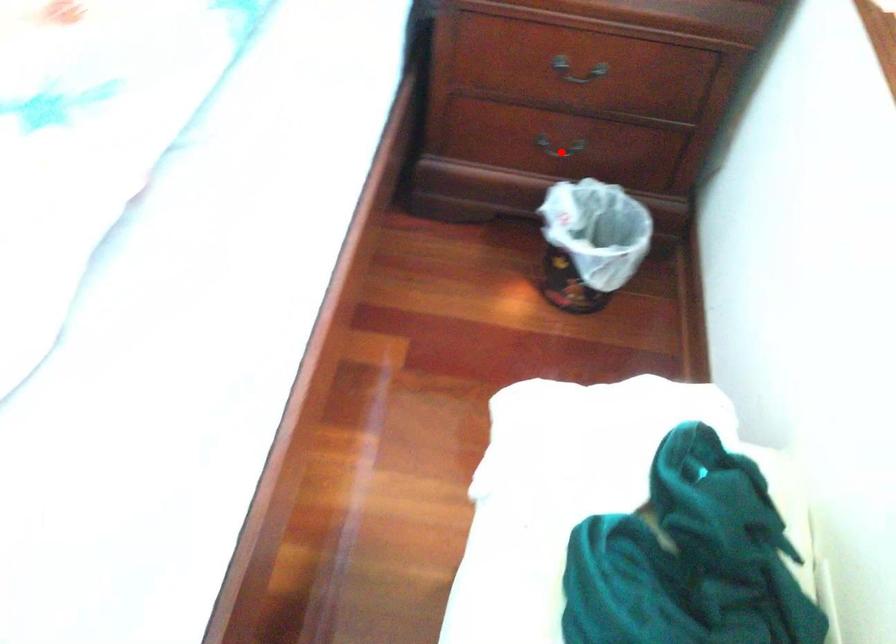
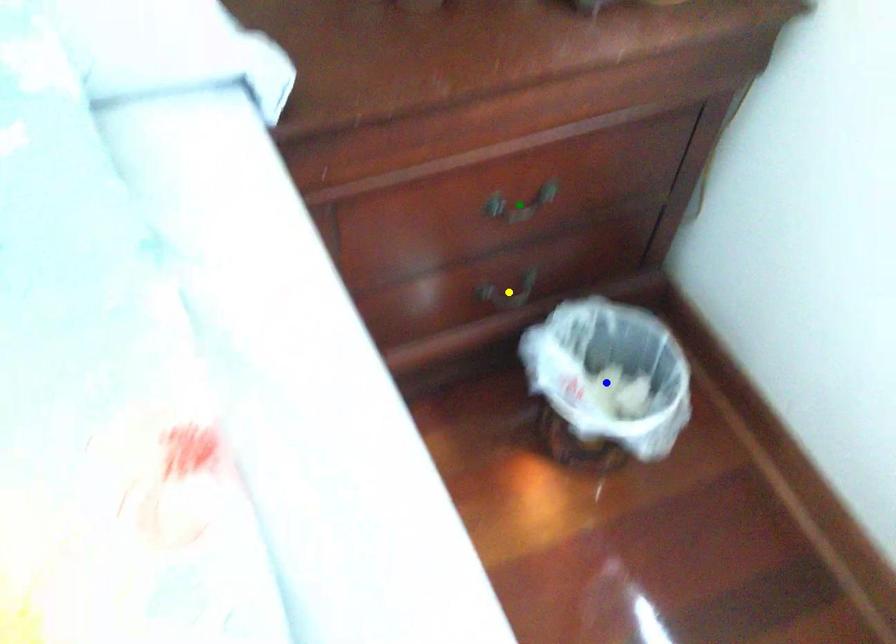
Question: I am providing you with two images of the same scene from different viewpoints. A red point is marked on the first image. You are given multiple points on the second image. Which mark in image 2 goes with the point in image 1?

Choices:
 (A) blue point
 (B) green point
 (C) yellow point

Answer: (C)